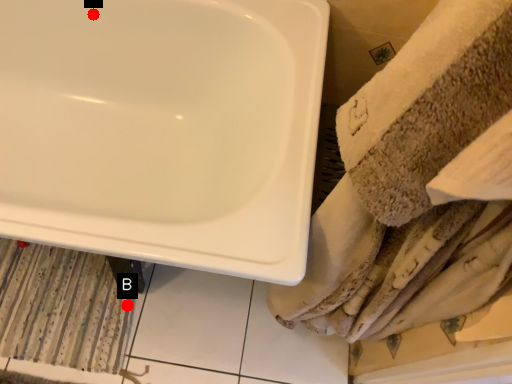
Question: Two points are circled on the image, labeled by A and B beside each circle. Which point appears closest to the camera in this image?

Choices:
 (A) A is closer
 (B) B is closer

Answer: (A)